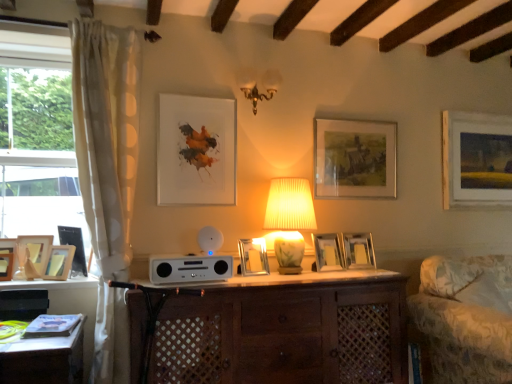
Locate an element on the screen. matte paper picture frame at upper center, placed as the fifth picture frame when sorted from left to right is located at coordinates (196, 151).

Identify the location of patterned fabric swivel chair at right. Image resolution: width=512 pixels, height=384 pixels. tap(464, 319).

What is the approximate height of wooden picture frame at left, acting as the third picture frame starting from the left?

8.08 inches.

This screenshot has height=384, width=512. Find the location of `silver metallic picture frame at center, the sixth picture frame positioned from the left`. silver metallic picture frame at center, the sixth picture frame positioned from the left is located at coordinates (253, 257).

Where is `wooden picture frame at left, marked as the 2th picture frame in a left-to-right arrangement`? The width and height of the screenshot is (512, 384). wooden picture frame at left, marked as the 2th picture frame in a left-to-right arrangement is located at coordinates (33, 254).

The width and height of the screenshot is (512, 384). Find the location of `matte paper picture frame at upper center, placed as the fifth picture frame when sorted from left to right`. matte paper picture frame at upper center, placed as the fifth picture frame when sorted from left to right is located at coordinates (196, 151).

Based on the photo, is matte paper picture frame at upper center, the 6th picture frame from the right, in front of or behind wooden picture frame at left, the ninth picture frame in the right-to-left sequence, in the image?

Clearly, matte paper picture frame at upper center, the 6th picture frame from the right, is behind wooden picture frame at left, the ninth picture frame in the right-to-left sequence.

Is matte paper picture frame at upper center, placed as the fifth picture frame when sorted from left to right, aimed at wooden picture frame at left, marked as the 2th picture frame in a left-to-right arrangement?

No, matte paper picture frame at upper center, placed as the fifth picture frame when sorted from left to right, is not facing towards wooden picture frame at left, marked as the 2th picture frame in a left-to-right arrangement.

In the scene shown: Between matte paper picture frame at upper center, the 6th picture frame from the right, and wooden picture frame at left, marked as the 2th picture frame in a left-to-right arrangement, which one appears on the right side from the viewer's perspective?

matte paper picture frame at upper center, the 6th picture frame from the right, is more to the right.

Is matte paper picture frame at upper center, placed as the fifth picture frame when sorted from left to right, wider than wooden picture frame at left, the ninth picture frame in the right-to-left sequence?

No, matte paper picture frame at upper center, placed as the fifth picture frame when sorted from left to right, is not wider than wooden picture frame at left, the ninth picture frame in the right-to-left sequence.

Consider the image. From a real-world perspective, is matte wooden picture frame at center, acting as the ninth picture frame starting from the left, on wooden picture frame at left, the 4th picture frame viewed from the left?

Yes, from a real-world perspective, matte wooden picture frame at center, acting as the ninth picture frame starting from the left, is on top of wooden picture frame at left, the 4th picture frame viewed from the left.

From the image's perspective, is matte wooden picture frame at center, which ranks as the 2th picture frame in right-to-left order, on top of wooden picture frame at left, marked as the 7th picture frame in a right-to-left arrangement?

Correct, matte wooden picture frame at center, which ranks as the 2th picture frame in right-to-left order, appears higher than wooden picture frame at left, marked as the 7th picture frame in a right-to-left arrangement, in the image.

Is matte wooden picture frame at center, acting as the ninth picture frame starting from the left, to the right of wooden picture frame at left, marked as the 7th picture frame in a right-to-left arrangement, from the viewer's perspective?

Indeed, matte wooden picture frame at center, acting as the ninth picture frame starting from the left, is positioned on the right side of wooden picture frame at left, marked as the 7th picture frame in a right-to-left arrangement.

Can wooden picture frame at left, marked as the 7th picture frame in a right-to-left arrangement, be found inside matte wooden picture frame at center, acting as the ninth picture frame starting from the left?

That's incorrect, wooden picture frame at left, marked as the 7th picture frame in a right-to-left arrangement, is not inside matte wooden picture frame at center, acting as the ninth picture frame starting from the left.

Considering their positions, is metallic silver picture frame at center, arranged as the 4th picture frame when viewed from the right, located in front of or behind wooden picture frame at upper right, placed as the first picture frame when sorted from right to left?

Visually, metallic silver picture frame at center, arranged as the 4th picture frame when viewed from the right, is located in front of wooden picture frame at upper right, placed as the first picture frame when sorted from right to left.

Is point (317, 263) closer or farther from the camera than point (505, 186)?

Point (317, 263).

Is metallic silver picture frame at center, the 7th picture frame positioned from the left, not near wooden picture frame at upper right, which is counted as the tenth picture frame, starting from the left?

metallic silver picture frame at center, the 7th picture frame positioned from the left, is positioned a significant distance from wooden picture frame at upper right, which is counted as the tenth picture frame, starting from the left.

How many degrees apart are the facing directions of metallic silver picture frame at center, the 7th picture frame positioned from the left, and wooden picture frame at upper right, placed as the first picture frame when sorted from right to left?

6.27 degrees separate the facing orientations of metallic silver picture frame at center, the 7th picture frame positioned from the left, and wooden picture frame at upper right, placed as the first picture frame when sorted from right to left.

Does point (461, 265) lie behind point (321, 263)?

Yes.

Does patterned fabric swivel chair at right come behind metallic silver picture frame at center, the 7th picture frame positioned from the left?

That is False.

Which picture frame is the 7th one when counting from the back of the patterned fabric swivel chair at right? Please provide its 2D coordinates.

[(328, 252)]

From the image's perspective, is patterned fabric swivel chair at right beneath metallic silver picture frame at center, arranged as the 4th picture frame when viewed from the right?

Yes.

Can you confirm if wooden picture frame at upper right, which is counted as the tenth picture frame, starting from the left, is taller than matte ceramic lamp at center?

Yes.

Does point (473, 202) come in front of point (269, 208)?

No, it is behind (269, 208).

Considering the sizes of wooden picture frame at upper right, placed as the first picture frame when sorted from right to left, and matte ceramic lamp at center in the image, is wooden picture frame at upper right, placed as the first picture frame when sorted from right to left, wider or thinner than matte ceramic lamp at center?

In the image, wooden picture frame at upper right, placed as the first picture frame when sorted from right to left, appears to be more narrow than matte ceramic lamp at center.

Would you say wooden picture frame at upper right, which is counted as the tenth picture frame, starting from the left, is outside matte ceramic lamp at center?

Yes, wooden picture frame at upper right, which is counted as the tenth picture frame, starting from the left, is not within matte ceramic lamp at center.

From the image's perspective, which object appears higher, wooden picture frame at left, the ninth picture frame in the right-to-left sequence, or wooden picture frame at left, acting as the third picture frame starting from the left?

wooden picture frame at left, the ninth picture frame in the right-to-left sequence, from the image's perspective.

Which point is more distant from viewer, (30, 242) or (42, 275)?

The point (30, 242) is farther.

Which object is further away from the camera, wooden picture frame at left, the ninth picture frame in the right-to-left sequence, or wooden picture frame at left, placed as the 8th picture frame when sorted from right to left?

Positioned behind is wooden picture frame at left, the ninth picture frame in the right-to-left sequence.

Is wooden picture frame at left, marked as the 2th picture frame in a left-to-right arrangement, bigger or smaller than wooden picture frame at left, placed as the 8th picture frame when sorted from right to left?

In the image, wooden picture frame at left, marked as the 2th picture frame in a left-to-right arrangement, appears to be larger than wooden picture frame at left, placed as the 8th picture frame when sorted from right to left.

Which is nearer, (362,235) or (68,265)?

The point (68,265) is closer to the camera.

Is metallic silver picture frame at center, which is the 8th picture frame from left to right, smaller than wooden picture frame at left, placed as the 8th picture frame when sorted from right to left?

No, metallic silver picture frame at center, which is the 8th picture frame from left to right, is not smaller than wooden picture frame at left, placed as the 8th picture frame when sorted from right to left.

Does metallic silver picture frame at center, positioned as the third picture frame in right-to-left order, have a lesser width compared to wooden picture frame at left, placed as the 8th picture frame when sorted from right to left?

Yes.

How much distance is there between metallic silver picture frame at center, which is the 8th picture frame from left to right, and wooden picture frame at left, placed as the 8th picture frame when sorted from right to left?

The distance of metallic silver picture frame at center, which is the 8th picture frame from left to right, from wooden picture frame at left, placed as the 8th picture frame when sorted from right to left, is 5.92 feet.

There is a matte paper picture frame at upper center, placed as the fifth picture frame when sorted from left to right. Where is `the 4th picture frame below it (from the image's perspective)`? The image size is (512, 384). the 4th picture frame below it (from the image's perspective) is located at coordinates (33, 254).

Where is `picture frame that is the 5th one when counting rightward from the wooden picture frame at left, marked as the 7th picture frame in a right-to-left arrangement`? picture frame that is the 5th one when counting rightward from the wooden picture frame at left, marked as the 7th picture frame in a right-to-left arrangement is located at coordinates (355, 158).

When comparing their distances from wooden picture frame at left, the 10th picture frame from the right, does matte wooden picture frame at center, which ranks as the 2th picture frame in right-to-left order, or silver metallic picture frame at center, the sixth picture frame positioned from the left, seem closer?

Based on the image, silver metallic picture frame at center, the sixth picture frame positioned from the left, appears to be nearer to wooden picture frame at left, the 10th picture frame from the right.

Considering their positions, is wooden picture frame at left, the 10th picture frame from the right, positioned further to white glossy stereo at center than wooden picture frame at left, the 4th picture frame viewed from the left?

wooden picture frame at left, the 10th picture frame from the right, is positioned further to the anchor white glossy stereo at center.

Considering their positions, is wooden desk at lower left positioned further to metallic silver picture frame at center, arranged as the 4th picture frame when viewed from the right, than wooden picture frame at left, marked as the 2th picture frame in a left-to-right arrangement?

The object further to metallic silver picture frame at center, arranged as the 4th picture frame when viewed from the right, is wooden picture frame at left, marked as the 2th picture frame in a left-to-right arrangement.

Based on their spatial positions, is silver metallic picture frame at center, the sixth picture frame positioned from the left, or wooden picture frame at left, marked as the 7th picture frame in a right-to-left arrangement, further from wooden picture frame at left, acting as the third picture frame starting from the left?

Among the two, silver metallic picture frame at center, the sixth picture frame positioned from the left, is located further to wooden picture frame at left, acting as the third picture frame starting from the left.

Looking at the image, which one is located further to white glossy stereo at center, wooden picture frame at left, which is the first picture frame from left to right, or wooden desk at lower left?

wooden picture frame at left, which is the first picture frame from left to right, is positioned further to the anchor white glossy stereo at center.

From the image, which object appears to be farther from white dotted fabric curtain at left, brown wooden cabinet at center or wooden picture frame at left, which is the first picture frame from left to right?

brown wooden cabinet at center is further to white dotted fabric curtain at left.

When comparing their distances from wooden picture frame at left, the 10th picture frame from the right, does metallic silver picture frame at center, positioned as the third picture frame in right-to-left order, or wooden picture frame at left, marked as the 7th picture frame in a right-to-left arrangement, seem closer?

wooden picture frame at left, marked as the 7th picture frame in a right-to-left arrangement, is closer to wooden picture frame at left, the 10th picture frame from the right.

Based on the photo, based on their spatial positions, is matte paper picture frame at upper center, placed as the fifth picture frame when sorted from left to right, or metallic silver picture frame at center, the 7th picture frame positioned from the left, further from matte wooden picture frame at center, which ranks as the 2th picture frame in right-to-left order?

matte paper picture frame at upper center, placed as the fifth picture frame when sorted from left to right, is positioned further to the anchor matte wooden picture frame at center, which ranks as the 2th picture frame in right-to-left order.

You are a GUI agent. You are given a task and a screenshot of the screen. Output one action in this format:
    pyautogui.click(x=<x>, y=<y>)
    Task: Click on the desk between wooden picture frame at left, the 10th picture frame from the right, and silver metallic picture frame at center, the fifth picture frame in the right-to-left sequence, from left to right
    The height and width of the screenshot is (384, 512).
    Given the screenshot: What is the action you would take?
    pyautogui.click(x=45, y=359)

This screenshot has width=512, height=384. I want to click on curtain between wooden picture frame at left, the 4th picture frame viewed from the left, and metallic silver picture frame at center, the 7th picture frame positioned from the left, so pyautogui.click(x=106, y=173).

This screenshot has height=384, width=512. Find the location of `table located between wooden picture frame at left, acting as the third picture frame starting from the left, and matte ceramic lamp at center in the left-right direction`. table located between wooden picture frame at left, acting as the third picture frame starting from the left, and matte ceramic lamp at center in the left-right direction is located at coordinates (272, 330).

Identify the location of curtain between wooden picture frame at left, acting as the third picture frame starting from the left, and matte paper picture frame at upper center, placed as the fifth picture frame when sorted from left to right, from left to right. click(x=106, y=173).